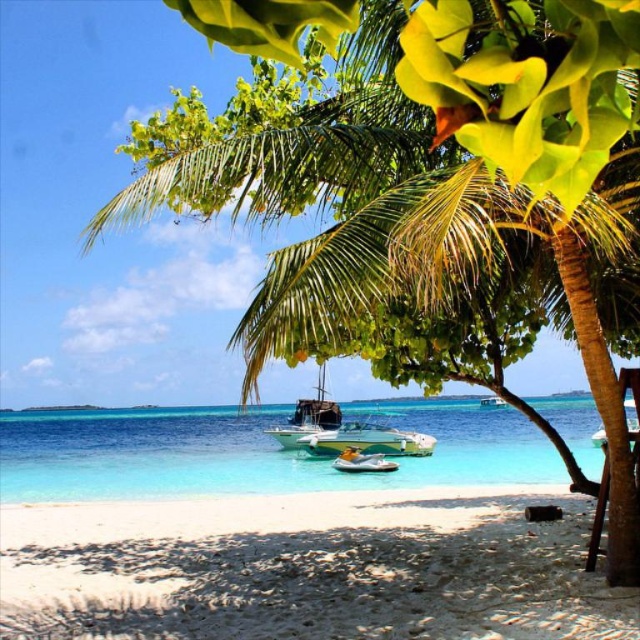
You are a photographer planning to capture the wooden sailboat at center and the white glossy boat at center from the beach. Which boat will appear taller in your photo?

The white glossy boat at center will appear taller in the photo because it has a greater height than the wooden sailboat at center.

You are standing on the beach and see both the green plastic boat at center and the white glossy boat at center. Which boat is closer to the palm tree?

The green plastic boat at center is positioned under the white glossy boat at center, meaning it is closer to the palm tree.

You are standing on the beach and want to reach the point marked as point (20, 573). If your walking speed is 1.5 meters per second, how long will it take you to reach there?

The distance between you and point (20, 573) is 6.87 meters. At a speed of 1.5 meters per second, it will take approximately 4.58 seconds to reach the point.